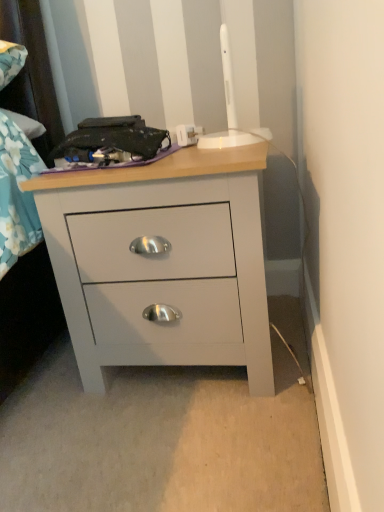
The image size is (384, 512). I want to click on free space in front of matte gray chest of drawers at center, so click(172, 445).